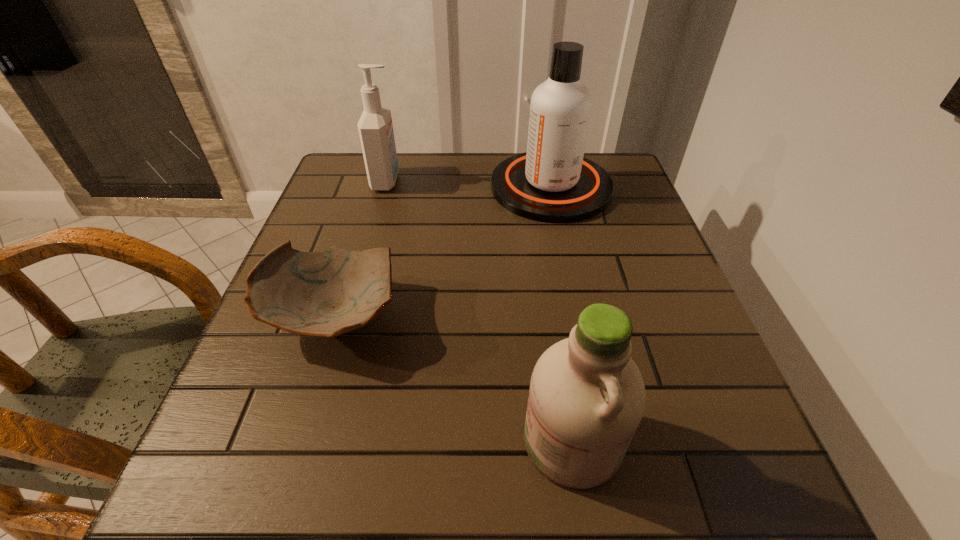
In order to click on the leftmost cleansing agent in this screenshot , I will do `click(375, 127)`.

The height and width of the screenshot is (540, 960). Identify the location of the nearest object. (587, 397).

Identify the location of the third farthest object. The height and width of the screenshot is (540, 960). (326, 293).

Locate an element on the screen. Image resolution: width=960 pixels, height=540 pixels. the shortest object is located at coordinates (326, 293).

At what (x,y) coordinates should I click in order to perform the action: click on vacant space situated on the front label of the leftmost cleansing agent. Please return your answer as a coordinate pair (x, y). Looking at the image, I should click on (504, 181).

Locate an element on the screen. vacant position located on the front label of the nearest object is located at coordinates (470, 441).

Locate an element on the screen. The width and height of the screenshot is (960, 540). free space located 0.120m on the front label of the nearest object is located at coordinates click(x=444, y=441).

The width and height of the screenshot is (960, 540). In order to click on blank space located on the front label of the nearest object in this screenshot , I will do `click(304, 441)`.

Find the location of a particular element. free location located 0.240m on the right of the second nearest object is located at coordinates (527, 318).

Find the location of a particular element. The image size is (960, 540). object that is at the near edge is located at coordinates (587, 397).